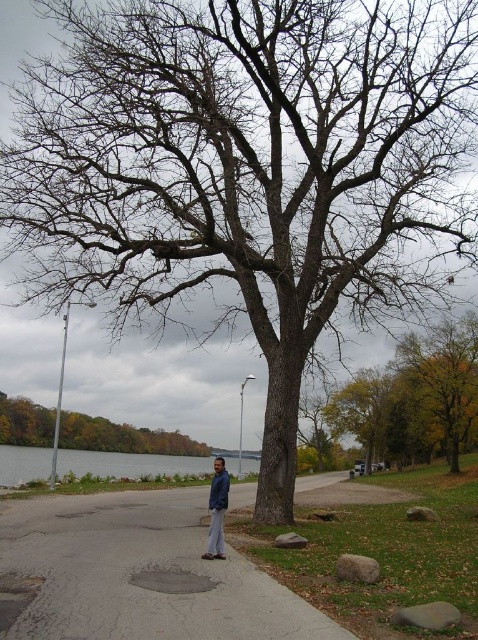
Question: Is green leafy tree at upper right positioned at the back of brown rough tree at center?

Choices:
 (A) no
 (B) yes

Answer: (A)

Question: Which is farther from the gray water at lower left?

Choices:
 (A) blue denim jacket at center
 (B) brown rough tree at center
 (C) gray asphalt sidewalk at center
 (D) green leafy tree at upper right

Answer: (C)

Question: Can you confirm if gray asphalt sidewalk at center is positioned to the right of brown rough tree at center?

Choices:
 (A) yes
 (B) no

Answer: (A)

Question: Does gray water at lower left appear on the right side of blue denim jacket at center?

Choices:
 (A) yes
 (B) no

Answer: (B)

Question: Which point is closer to the camera?

Choices:
 (A) (167, 508)
 (B) (43, 416)
 (C) (446, 404)

Answer: (A)

Question: Among these objects, which one is nearest to the camera?

Choices:
 (A) gray water at lower left
 (B) brown rough tree at center
 (C) green leafy tree at upper right
 (D) gray asphalt sidewalk at center

Answer: (D)